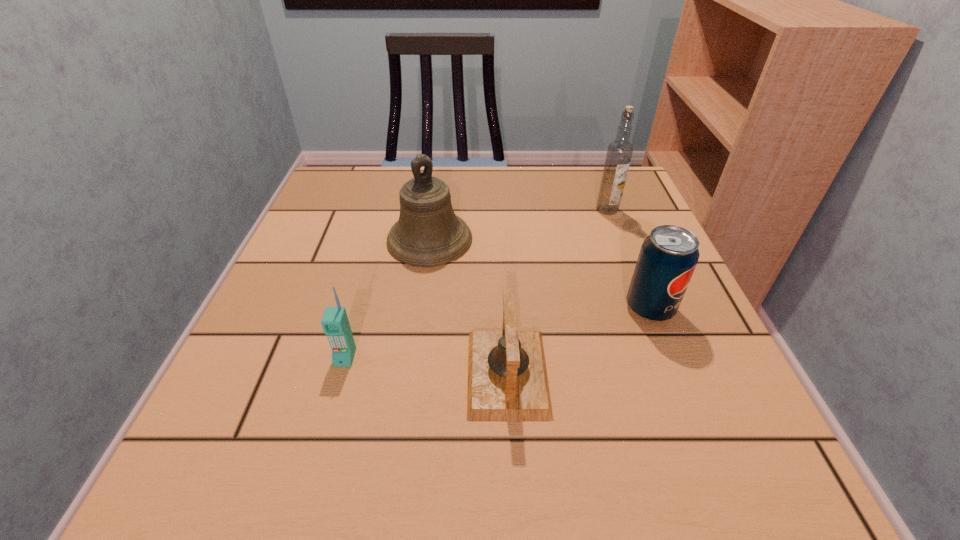
I want to click on free space between the farther bell and the nearer bell, so click(468, 306).

Locate an element on the screen. The width and height of the screenshot is (960, 540). empty space between the taller bell and the leftmost object is located at coordinates (387, 299).

At what (x,y) coordinates should I click in order to perform the action: click on free space between the soda can and the shortest object. Please return your answer as a coordinate pair (x, y). This screenshot has height=540, width=960. Looking at the image, I should click on (579, 341).

Find the location of a particular element. free space between the taller bell and the vodka is located at coordinates (518, 225).

The width and height of the screenshot is (960, 540). In order to click on the closest object relative to the taller bell in this screenshot , I will do `click(507, 377)`.

Point out which object is positioned as the second nearest to the taller bell. Please provide its 2D coordinates. Your answer should be formatted as a tuple, i.e. [(x, y)], where the tuple contains the x and y coordinates of a point satisfying the conditions above.

[(335, 323)]

The width and height of the screenshot is (960, 540). I want to click on vacant space that satisfies the following two spatial constraints: 1. on the label of the tallest object; 2. on the left side of the soda can, so click(645, 308).